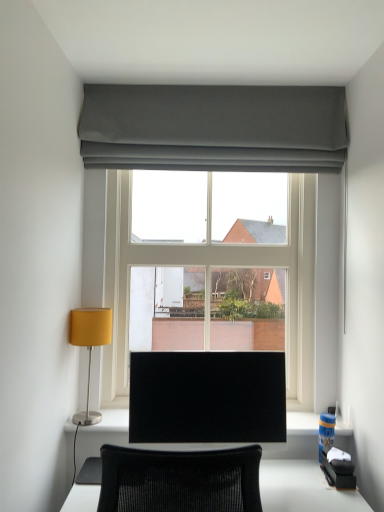
Question: Considering the relative sizes of dark gray fabric at upper center and black glossy monitor at center in the image provided, is dark gray fabric at upper center wider than black glossy monitor at center?

Choices:
 (A) yes
 (B) no

Answer: (A)

Question: Considering the relative positions of dark gray fabric at upper center and black glossy monitor at center in the image provided, is dark gray fabric at upper center behind black glossy monitor at center?

Choices:
 (A) yes
 (B) no

Answer: (A)

Question: Is dark gray fabric at upper center facing towards black glossy monitor at center?

Choices:
 (A) yes
 (B) no

Answer: (B)

Question: Would you say black glossy monitor at center is part of dark gray fabric at upper center's contents?

Choices:
 (A) no
 (B) yes

Answer: (A)

Question: From a real-world perspective, is dark gray fabric at upper center positioned under black glossy monitor at center based on gravity?

Choices:
 (A) no
 (B) yes

Answer: (A)

Question: From the image's perspective, does dark gray fabric at upper center appear lower than black glossy monitor at center?

Choices:
 (A) no
 (B) yes

Answer: (A)

Question: Considering the relative positions of clear glass window at center and black glossy monitor at center in the image provided, is clear glass window at center in front of black glossy monitor at center?

Choices:
 (A) yes
 (B) no

Answer: (B)

Question: Is clear glass window at center positioned far away from black glossy monitor at center?

Choices:
 (A) no
 (B) yes

Answer: (A)

Question: Can you confirm if clear glass window at center is shorter than black glossy monitor at center?

Choices:
 (A) no
 (B) yes

Answer: (A)

Question: Is clear glass window at center oriented towards black glossy monitor at center?

Choices:
 (A) no
 (B) yes

Answer: (B)

Question: Is clear glass window at center smaller than black glossy monitor at center?

Choices:
 (A) no
 (B) yes

Answer: (A)

Question: From a real-world perspective, is clear glass window at center beneath black glossy monitor at center?

Choices:
 (A) no
 (B) yes

Answer: (A)

Question: From the image's perspective, is matte yellow lampshade at left on dark gray fabric at upper center?

Choices:
 (A) no
 (B) yes

Answer: (A)